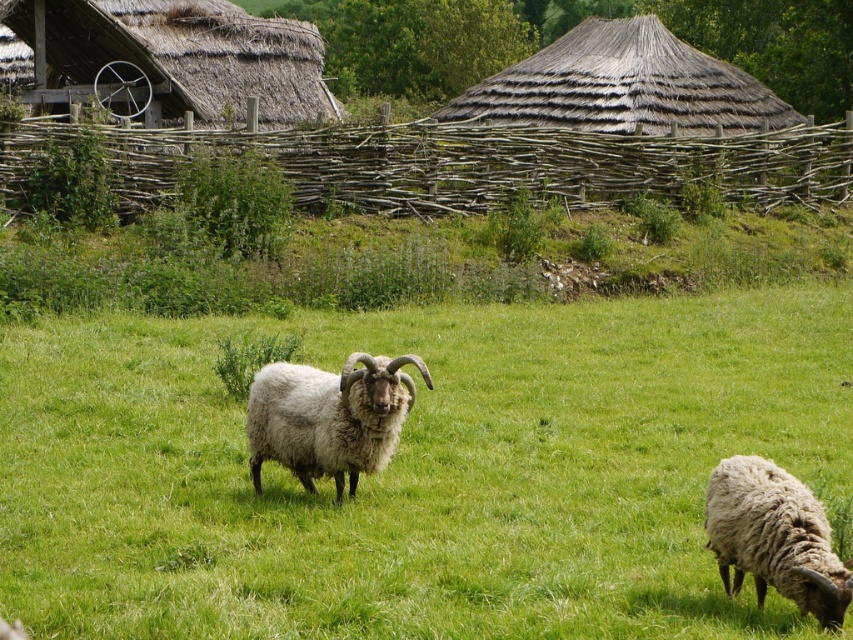
Question: Which point appears farthest from the camera in this image?

Choices:
 (A) [x=689, y=180]
 (B) [x=825, y=550]
 (C) [x=434, y=189]

Answer: (A)

Question: Among these points, which one is farthest from the camera?

Choices:
 (A) (517, 104)
 (B) (55, 141)

Answer: (A)

Question: Does fuzzy woolly ram at center come behind white woolly sheep at lower right?

Choices:
 (A) yes
 (B) no

Answer: (A)

Question: Does thatched straw hut at upper left have a greater width compared to thatched straw hut at upper center?

Choices:
 (A) yes
 (B) no

Answer: (B)

Question: Which of these objects is positioned farthest from the thatched straw hut at upper center?

Choices:
 (A) fuzzy woolly ram at center
 (B) thatched straw hut at upper left
 (C) white woolly sheep at lower right
 (D) brown wooden fence at upper center

Answer: (C)

Question: Is thatched straw hut at upper center further to the viewer compared to fuzzy woolly ram at center?

Choices:
 (A) yes
 (B) no

Answer: (A)